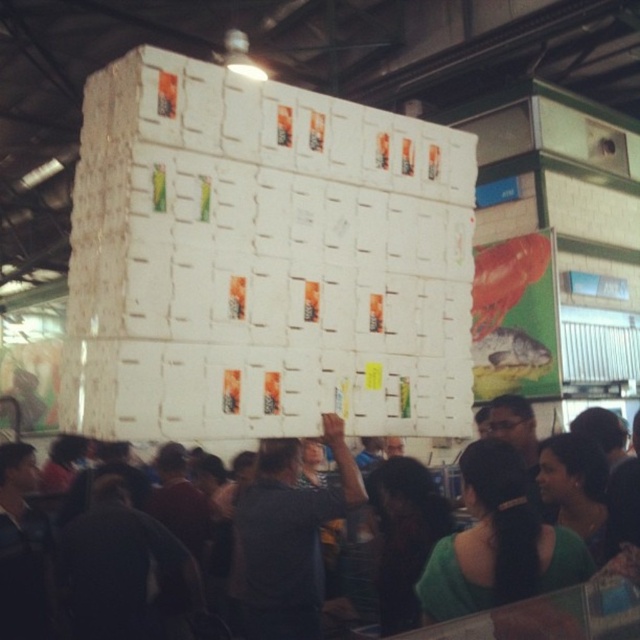
Is dark gray fabric shirt at center further to the viewer compared to matte white boxes at center?

Yes.

Can you confirm if dark gray fabric shirt at center is taller than matte white boxes at center?

Yes.

The height and width of the screenshot is (640, 640). What do you see at coordinates (288, 536) in the screenshot? I see `dark gray fabric shirt at center` at bounding box center [288, 536].

You are a GUI agent. You are given a task and a screenshot of the screen. Output one action in this format:
    pyautogui.click(x=<x>, y=<y>)
    Task: Click on the dark gray fabric shirt at center
    This screenshot has height=640, width=640.
    Given the screenshot: What is the action you would take?
    point(288,536)